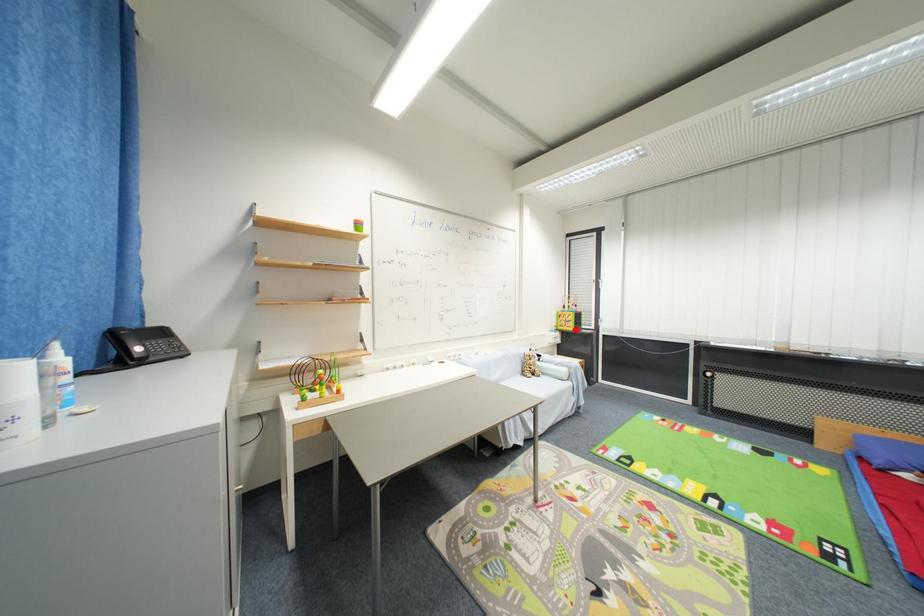
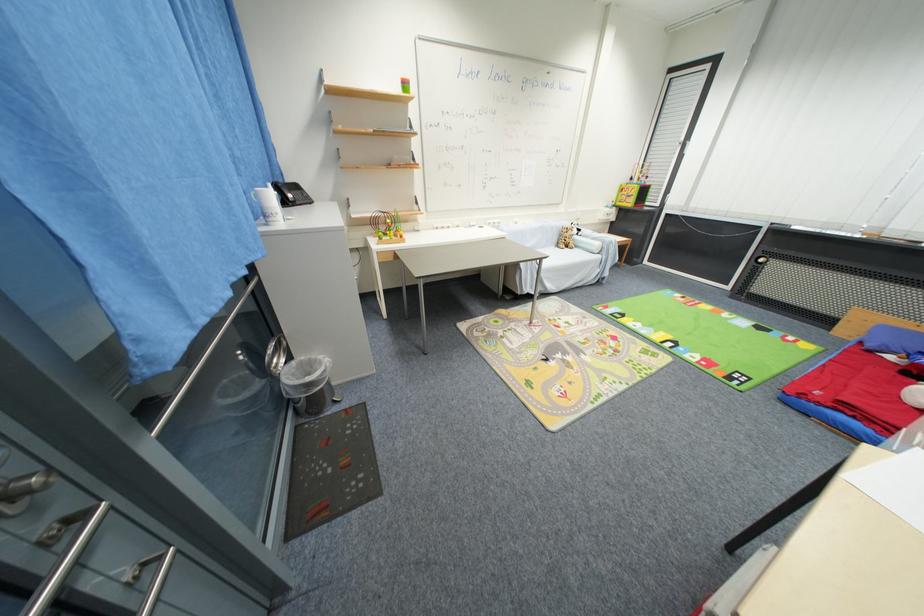
Question: I am providing you with two images of the same scene from different viewpoints. A red point is shown in image1. For the corresponding object point in image2, is it positioned nearer or farther from the camera?

Choices:
 (A) Nearer
 (B) Farther

Answer: (A)